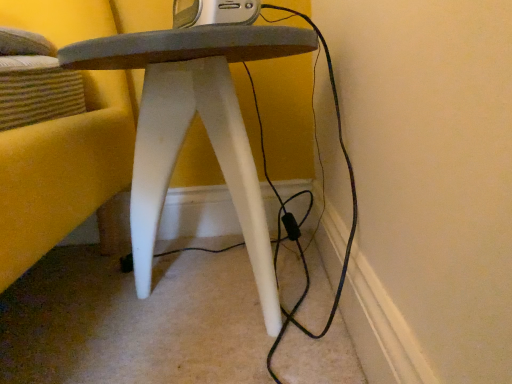
Question: From the image's perspective, is white matte stool at center over silver metallic radio at upper center?

Choices:
 (A) no
 (B) yes

Answer: (A)

Question: Is white matte stool at center at the right side of silver metallic radio at upper center?

Choices:
 (A) yes
 (B) no

Answer: (B)

Question: Is white matte stool at center thinner than silver metallic radio at upper center?

Choices:
 (A) yes
 (B) no

Answer: (B)

Question: From a real-world perspective, is white matte stool at center under silver metallic radio at upper center?

Choices:
 (A) no
 (B) yes

Answer: (B)

Question: From a real-world perspective, is white matte stool at center over silver metallic radio at upper center?

Choices:
 (A) yes
 (B) no

Answer: (B)

Question: Does white matte stool at center have a larger size compared to silver metallic radio at upper center?

Choices:
 (A) yes
 (B) no

Answer: (A)

Question: Is silver metallic radio at upper center in contact with white matte stool at center?

Choices:
 (A) yes
 (B) no

Answer: (B)

Question: Is silver metallic radio at upper center positioned in front of white matte stool at center?

Choices:
 (A) no
 (B) yes

Answer: (A)

Question: From a real-world perspective, is silver metallic radio at upper center under white matte stool at center?

Choices:
 (A) no
 (B) yes

Answer: (A)

Question: Can you confirm if silver metallic radio at upper center is wider than white matte stool at center?

Choices:
 (A) yes
 (B) no

Answer: (B)

Question: Is silver metallic radio at upper center at the right side of white matte stool at center?

Choices:
 (A) yes
 (B) no

Answer: (A)

Question: Could you tell me if silver metallic radio at upper center is turned towards white matte stool at center?

Choices:
 (A) yes
 (B) no

Answer: (B)

Question: Considering the positions of white matte stool at center and silver metallic radio at upper center in the image, is white matte stool at center wider or thinner than silver metallic radio at upper center?

Choices:
 (A) thin
 (B) wide

Answer: (B)